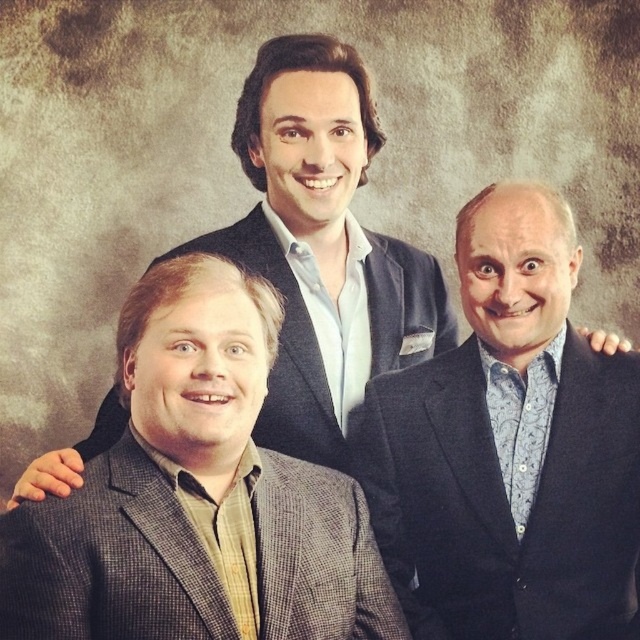
Looking at this image, you are a photographer standing 2 meters away from the matte black suit at center. You want to take a photo of the two men so that they appear in the same frame. Given that the camera has a 50mm lens with a field of view of 46 degrees, will you need to move closer or farther away to ensure both subjects are fully visible in the frame?

Since the two men are 1.74 meters apart and the photographer is currently 2 meters away, moving closer would decrease the distance, increasing the field of view coverage. To include both subjects within the 46 degree field of view, the photographer should move slightly closer to ensure the 1.74 meter separation fits within the lens

You are a photographer who needs to adjust the lighting so that the gray checkered suit at lower left and the gray wool blazer at center are equally illuminated. Which object requires more light adjustment?

The gray checkered suit at lower left has a lesser height compared to the gray wool blazer at center, so it requires more light adjustment to ensure equal illumination.

You are a photographer setting up for a group photo. You need to ensure that the gray checkered suit at lower left and the gray wool blazer at center are visible in the frame. Based on their positions, which one is closer to the left edge of the image?

The gray checkered suit at lower left is positioned on the left side of gray wool blazer at center, so it is closer to the left edge of the image.